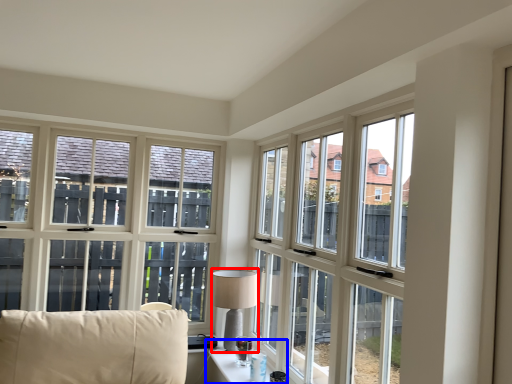
Question: Which object appears closest to the camera in this image, table lamp (highlighted by a red box) or table (highlighted by a blue box)?

Choices:
 (A) table lamp
 (B) table

Answer: (B)